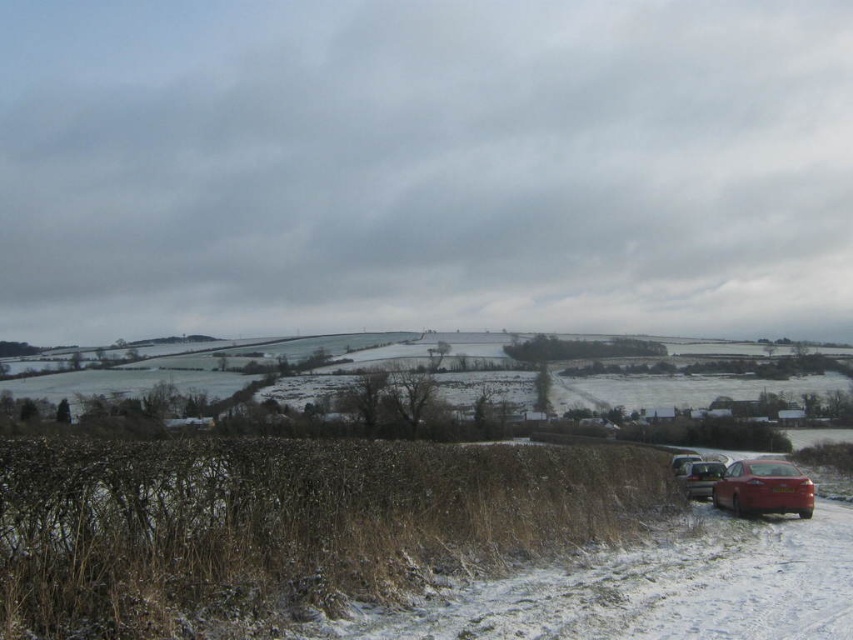
Question: Which of these objects is positioned farthest from the smooth asphalt road at lower right?

Choices:
 (A) shiny red car at lower right
 (B) metallic silver car at lower right

Answer: (B)

Question: Is shiny red car at lower right to the left of metallic silver car at lower right from the viewer's perspective?

Choices:
 (A) no
 (B) yes

Answer: (A)

Question: Which point is farther to the camera?

Choices:
 (A) (711, 483)
 (B) (190, 588)
 (C) (796, 506)

Answer: (A)

Question: Is shiny red car at lower right wider than metallic silver car at lower right?

Choices:
 (A) yes
 (B) no

Answer: (A)

Question: Does smooth asphalt road at lower right have a smaller size compared to shiny red car at lower right?

Choices:
 (A) no
 (B) yes

Answer: (A)

Question: Which object appears closest to the camera in this image?

Choices:
 (A) shiny red car at lower right
 (B) smooth asphalt road at lower right
 (C) metallic silver car at lower right

Answer: (B)